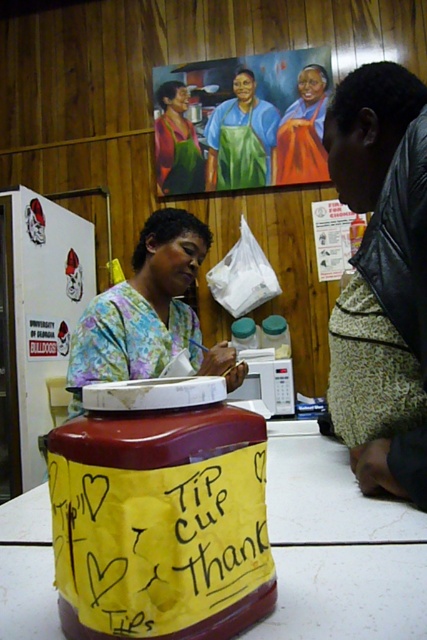
Between point (114, 308) and point (193, 156), which one is positioned behind?

The point (193, 156) is behind.

Is point (102, 340) positioned behind point (173, 131)?

No, (102, 340) is closer to viewer.

Find the location of a particular element. This screenshot has width=427, height=640. floral fabric blouse at center is located at coordinates (149, 312).

What do you see at coordinates (382, 280) in the screenshot? I see `green knitted sweater at lower right` at bounding box center [382, 280].

Does green knitted sweater at lower right have a lesser width compared to orange fabric dress at center?

Yes.

The height and width of the screenshot is (640, 427). I want to click on green knitted sweater at lower right, so click(382, 280).

What are the coordinates of `green knitted sweater at lower right` in the screenshot? It's located at (382, 280).

Consider the image. Is yellow paper at center to the left of green knitted sweater at lower right from the viewer's perspective?

Yes, yellow paper at center is to the left of green knitted sweater at lower right.

The height and width of the screenshot is (640, 427). Find the location of `yellow paper at center`. yellow paper at center is located at coordinates (163, 547).

Find the location of `yellow paper at center`. yellow paper at center is located at coordinates (163, 547).